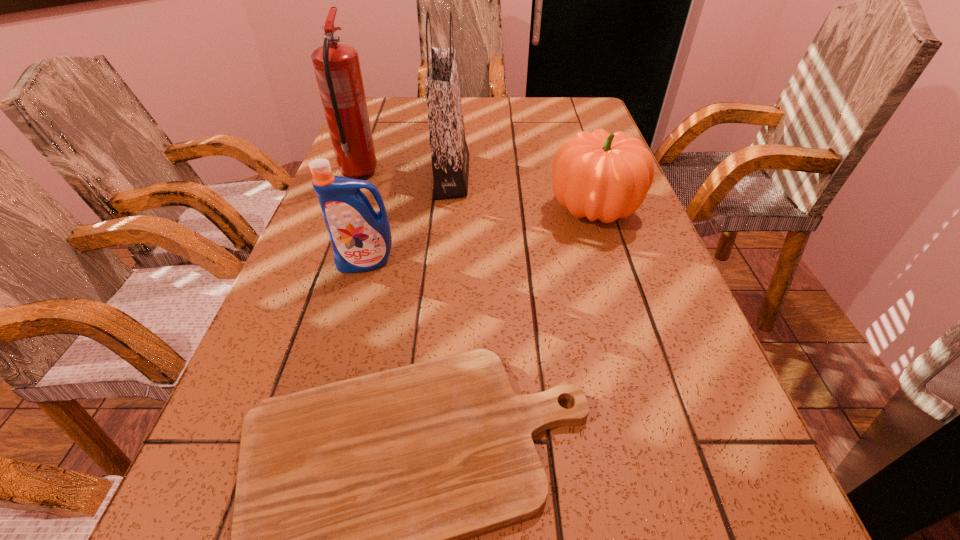
Identify the location of shopping bag. This screenshot has width=960, height=540. (449, 152).

The width and height of the screenshot is (960, 540). Find the location of `fire extinguisher`. fire extinguisher is located at coordinates (337, 69).

You are a GUI agent. You are given a task and a screenshot of the screen. Output one action in this format:
    pyautogui.click(x=<x>, y=<y>)
    Task: Click on the detergent
    
    Given the screenshot: What is the action you would take?
    pyautogui.click(x=361, y=240)

The height and width of the screenshot is (540, 960). What are the coordinates of `the fourth farthest object` in the screenshot? It's located at (361, 240).

Identify the location of the second shortest object. (597, 175).

This screenshot has height=540, width=960. Find the location of `free spot located on the front of the shopping bag with the design`. free spot located on the front of the shopping bag with the design is located at coordinates (561, 176).

Identify the location of free point located 0.290m on the handle side the fire extinguisher. (380, 116).

Where is `free space located on the handle side the fire extinguisher`? The image size is (960, 540). free space located on the handle side the fire extinguisher is located at coordinates (385, 105).

You are a GUI agent. You are given a task and a screenshot of the screen. Output one action in this format:
    pyautogui.click(x=<x>, y=<y>)
    Task: Click on the vacant area situated 0.280m on the handle side the fire extinguisher
    The height and width of the screenshot is (540, 960).
    Given the screenshot: What is the action you would take?
    pyautogui.click(x=380, y=117)

Image resolution: width=960 pixels, height=540 pixels. In order to click on free space located 0.220m on the label of the second nearest object in this screenshot , I will do `click(338, 361)`.